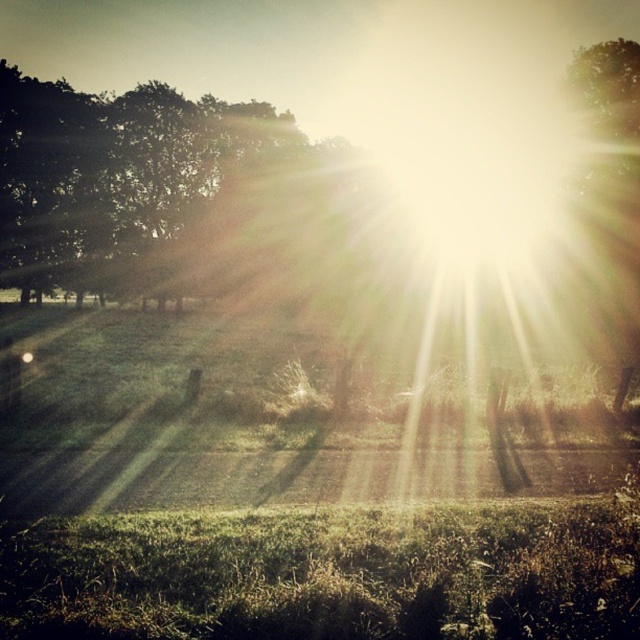
From the picture: Can you confirm if green leafy tree at upper left is wider than green leafy tree at upper right?

Yes, green leafy tree at upper left is wider than green leafy tree at upper right.

Who is more forward, (x=284, y=140) or (x=609, y=115)?

Point (x=609, y=115) is more forward.

Does point (45, 166) come in front of point (586, 60)?

That is False.

The image size is (640, 640). Identify the location of green leafy tree at upper left. (109, 173).